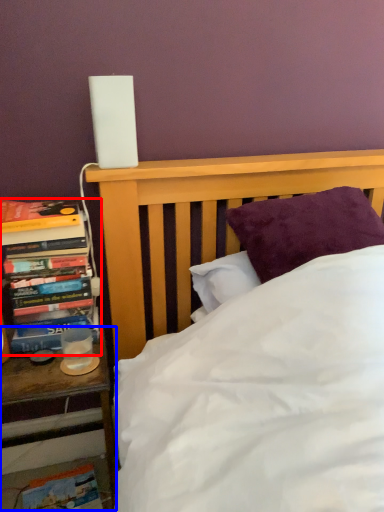
Question: Which point is further to the camera, book (highlighted by a red box) or nightstand (highlighted by a blue box)?

Choices:
 (A) book
 (B) nightstand

Answer: (A)